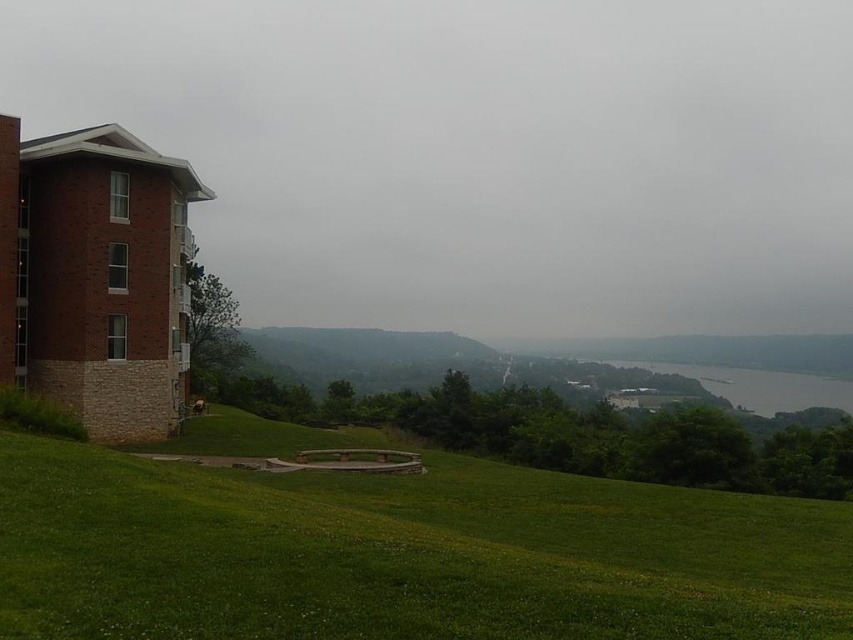
You are standing at the point labeled point (664,614) and want to walk towards the building on the left side of the frame. Will you pass by point (839,401) on your way?

Since point (664,614) is in front of point (839,401), walking towards the building on the left side of the frame would mean moving away from point (839,401). Therefore, you will not pass by point (839,401) on your way.